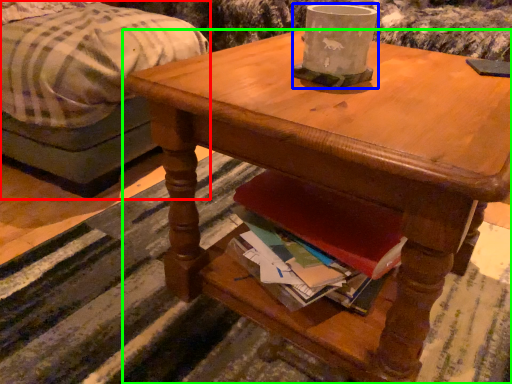
Question: Which is nearer to the studio couch (highlighted by a red box)? coffee cup (highlighted by a blue box) or desk (highlighted by a green box).

Choices:
 (A) coffee cup
 (B) desk

Answer: (B)